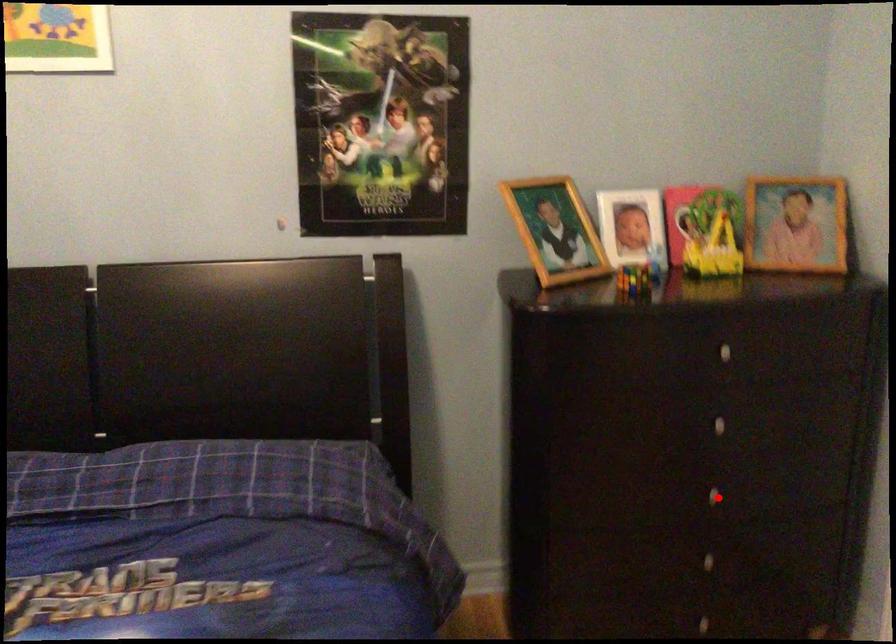
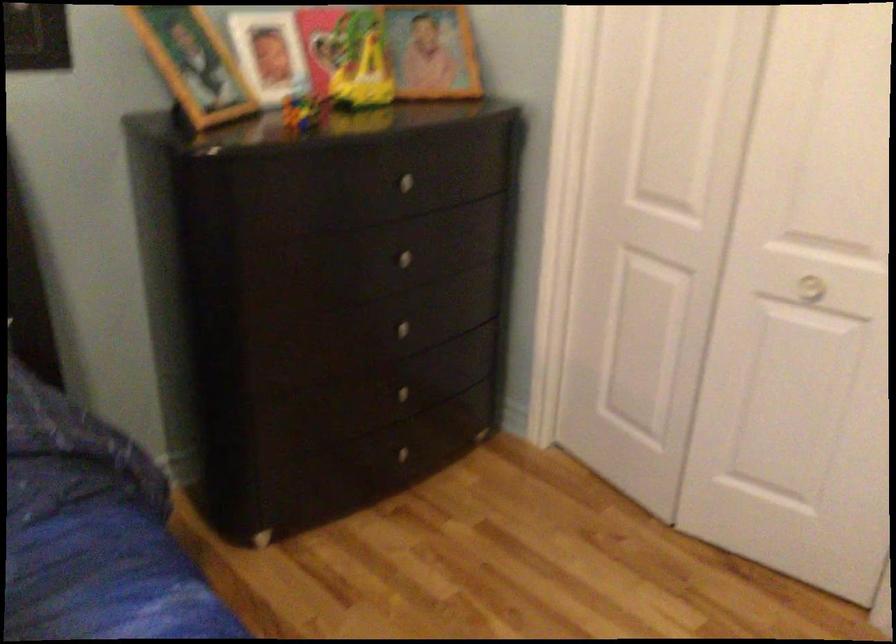
Find the pixel in the second image that matches the highlighted location in the first image.

(409, 332)